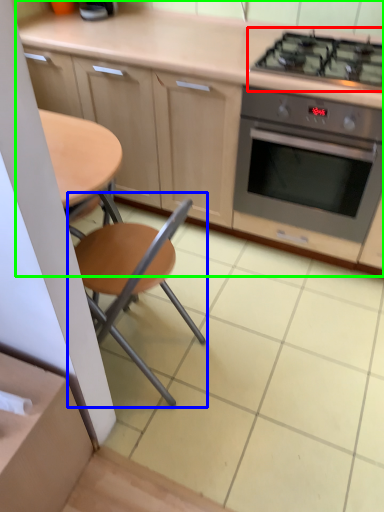
Question: Which object is the closest to the gas stove (highlighted by a red box)? Choose among these: chair (highlighted by a blue box) or cabinetry (highlighted by a green box).

Choices:
 (A) chair
 (B) cabinetry

Answer: (B)